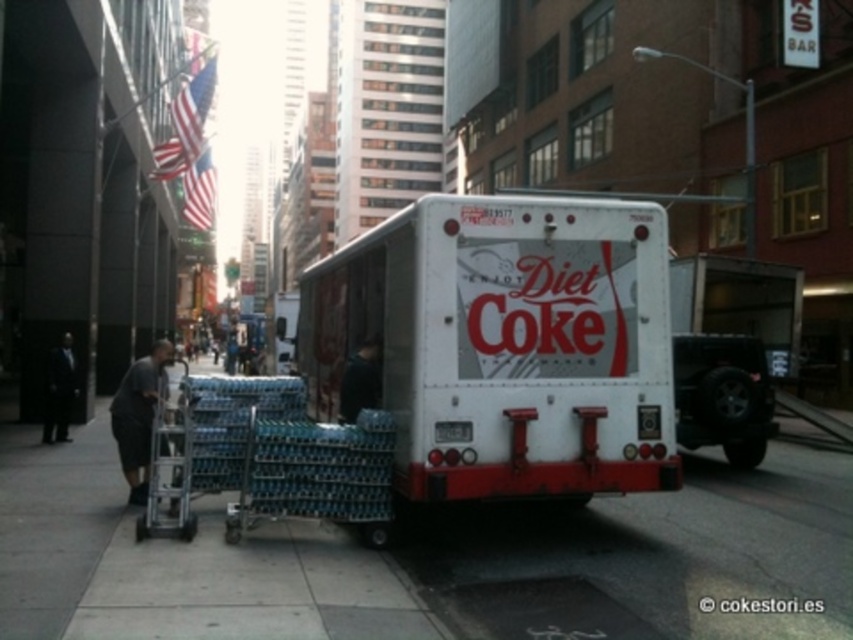
You are standing at the center of the image. Which direction should you walk to reach the white concrete sidewalk at lower center?

Since the white concrete sidewalk at lower center is located at the lower center of the image, you should walk downward from the center to reach it.

You are a delivery person who needs to park your white matte truck at center on the white concrete sidewalk at lower center. Can you fit the truck on the sidewalk without overlapping the sidewalk?

The white concrete sidewalk at lower center has a larger size compared to the white matte truck at center, so the truck can fit on the sidewalk without overlapping.